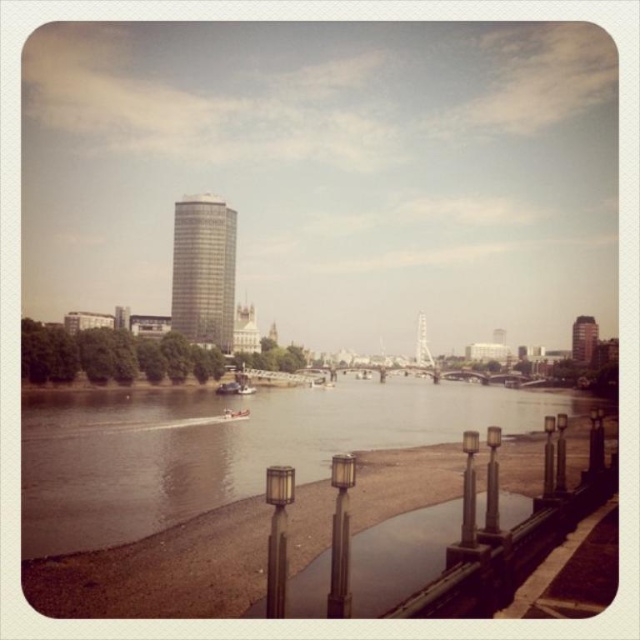
You are a photographer planning to capture the entire view of the silver glass tower at center and the brown water at center in one shot. Based on the scene, can you fit both objects in the frame without cropping either of them?

The brown water at center is wider than the silver glass tower at center, so it should be possible to capture both in a single frame as long as the camera is positioned to include the full width of the wider object, which would naturally encompass the narrower one.

You are a photographer planning to take a landscape photo of the riverside scene. You want to ensure that both the brown water at center and the metallic glass tower at upper right are clearly visible in the frame. Based on their relative sizes in the image, which object should you focus on first to ensure proper depth of field?

The brown water at center is taller than the metallic glass tower at upper right, so you should focus on the brown water at center first to ensure proper depth of field since it occupies a larger portion of the frame.

You are an architect analyzing the riverside layout. You observe the silver glass tower at center and the metallic glass tower at upper right. Which tower is located to the left of the other?

The silver glass tower at center is positioned on the left side of metallic glass tower at upper right.